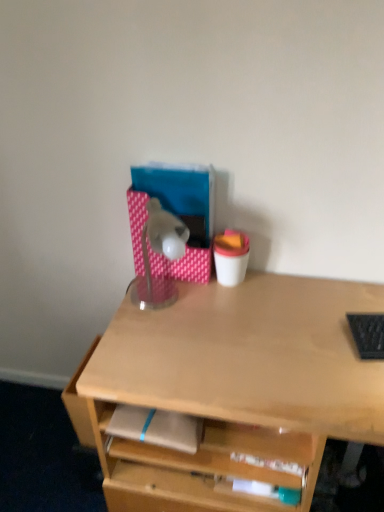
Question: From the image's perspective, is light brown matte notepad at center above translucent plastic lamp at center?

Choices:
 (A) yes
 (B) no

Answer: (B)

Question: Is light brown matte notepad at center wider than translucent plastic lamp at center?

Choices:
 (A) yes
 (B) no

Answer: (B)

Question: Does light brown matte notepad at center have a lesser width compared to translucent plastic lamp at center?

Choices:
 (A) yes
 (B) no

Answer: (A)

Question: From a real-world perspective, is light brown matte notepad at center positioned under translucent plastic lamp at center based on gravity?

Choices:
 (A) no
 (B) yes

Answer: (B)

Question: Is light brown matte notepad at center smaller than translucent plastic lamp at center?

Choices:
 (A) yes
 (B) no

Answer: (A)

Question: In terms of height, does light brown matte notepad at center look taller or shorter compared to translucent plastic lamp at center?

Choices:
 (A) tall
 (B) short

Answer: (B)

Question: Is light brown matte notepad at center to the left or to the right of translucent plastic lamp at center in the image?

Choices:
 (A) left
 (B) right

Answer: (A)

Question: Is point (148, 423) closer or farther from the camera than point (148, 221)?

Choices:
 (A) closer
 (B) farther

Answer: (A)

Question: Relative to translucent plastic lamp at center, is light brown matte notepad at center in front or behind?

Choices:
 (A) front
 (B) behind

Answer: (A)

Question: Considering the positions of point (377, 331) and point (180, 240), is point (377, 331) closer or farther from the camera than point (180, 240)?

Choices:
 (A) farther
 (B) closer

Answer: (B)

Question: Is black textured laptop keyboard at right wider or thinner than translucent plastic lamp at center?

Choices:
 (A) wide
 (B) thin

Answer: (B)

Question: From their relative heights in the image, would you say black textured laptop keyboard at right is taller or shorter than translucent plastic lamp at center?

Choices:
 (A) tall
 (B) short

Answer: (B)

Question: Based on their positions, is black textured laptop keyboard at right located to the left or right of translucent plastic lamp at center?

Choices:
 (A) right
 (B) left

Answer: (A)

Question: From a real-world perspective, is translucent plastic lamp at center physically located above or below light brown matte notepad at center?

Choices:
 (A) below
 (B) above

Answer: (B)

Question: Is translucent plastic lamp at center inside or outside of light brown matte notepad at center?

Choices:
 (A) inside
 (B) outside

Answer: (B)